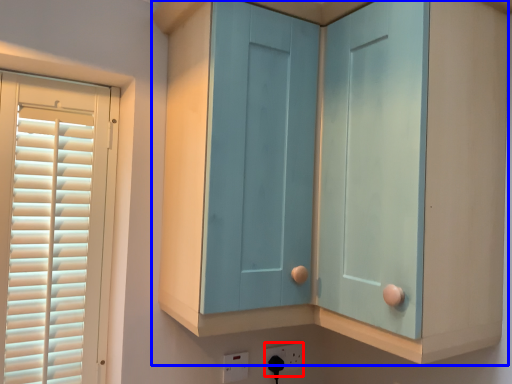
Question: Which object is closer to the camera taking this photo, electric outlet (highlighted by a red box) or cupboard (highlighted by a blue box)?

Choices:
 (A) electric outlet
 (B) cupboard

Answer: (B)